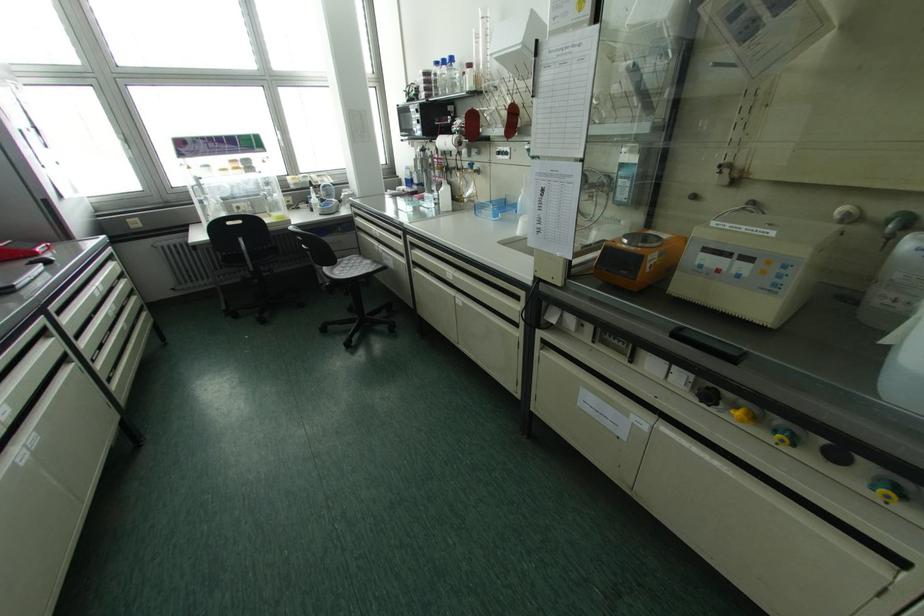
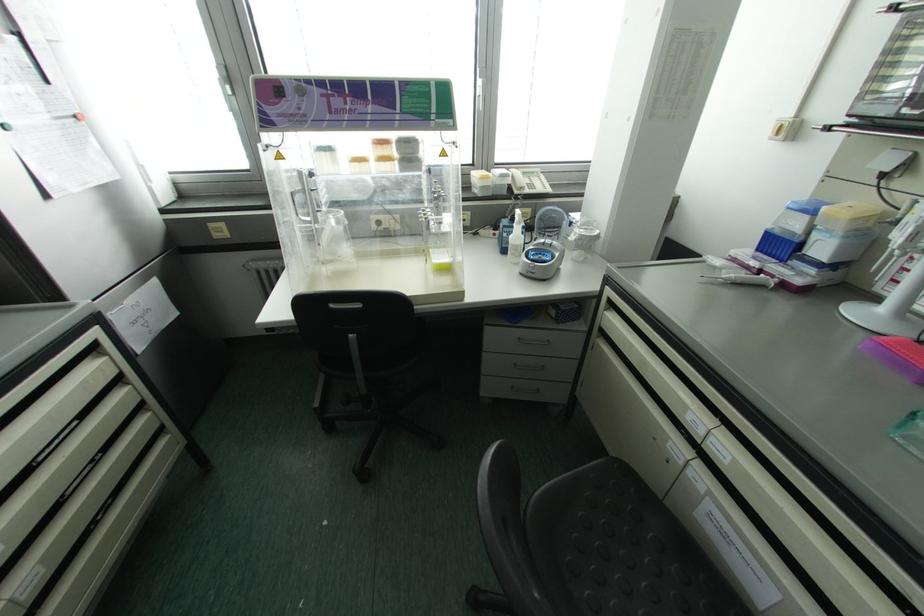
What movement of the cameraman would produce the second image?

The cameraman moved toward left, forward.